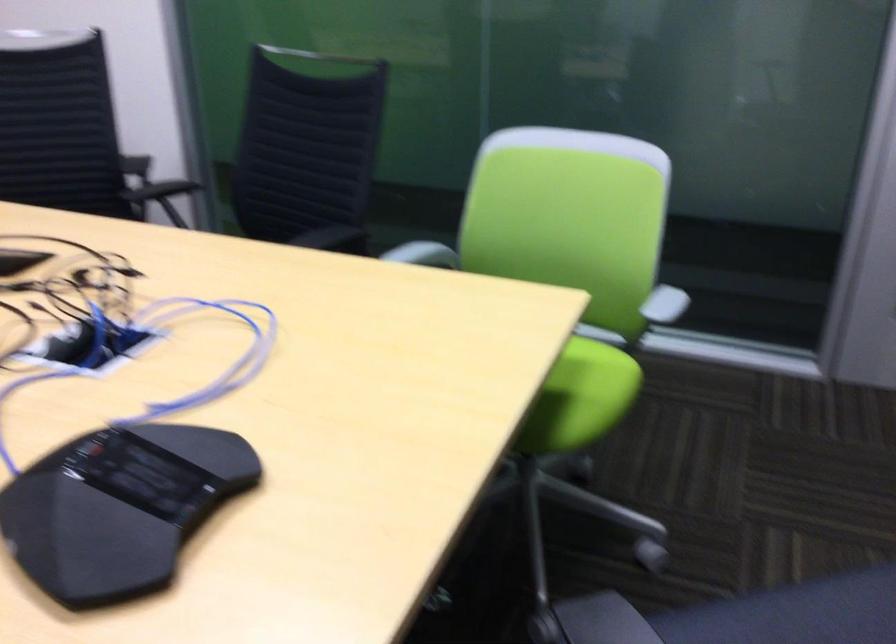
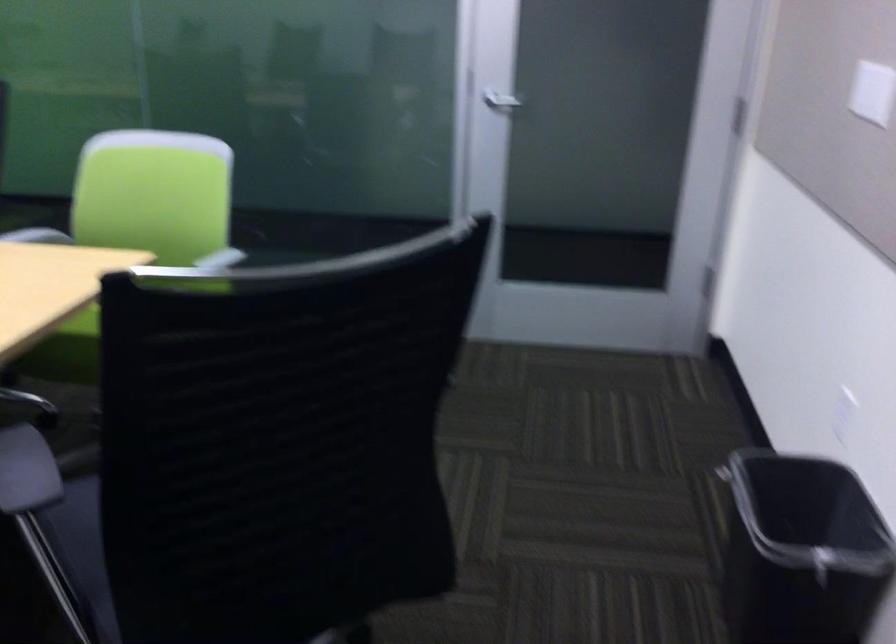
Question: I am providing you with two images of the same scene from different viewpoints. Please identify which objects are invisible in image2.

Choices:
 (A) dark drinking glass
 (B) black trash can
 (C) green chair sitting surface
 (D) silver door handle

Answer: (C)